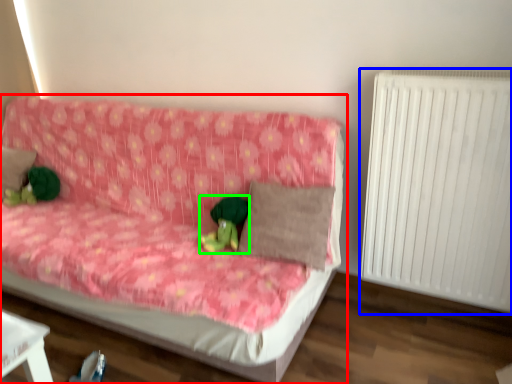
Question: Which object is positioned closest to studio couch (highlighted by a red box)? Select from radiator (highlighted by a blue box) and toy (highlighted by a green box).

Choices:
 (A) radiator
 (B) toy

Answer: (B)